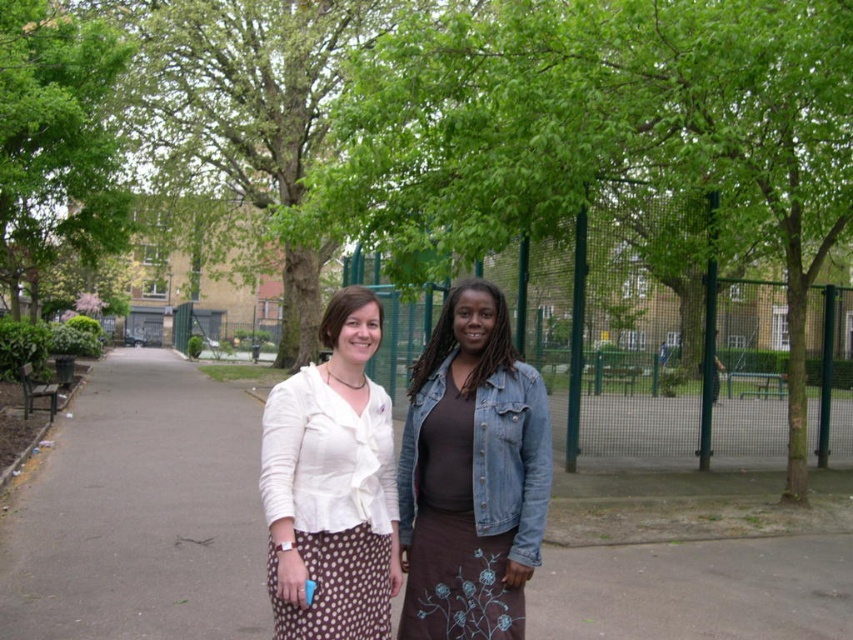
You are a painter standing at the edge of the brown asphalt at center, wanting to paint the green leafy tree at upper left. Your easel is 1.5 meters wide. Can you fit the entire tree within your canvas if you stand at your current position?

The distance between the brown asphalt at center and the green leafy tree at upper left is 6.33 meters. Since the easel is 1.5 meters wide, the tree can be fully captured within the canvas as the distance is sufficient.